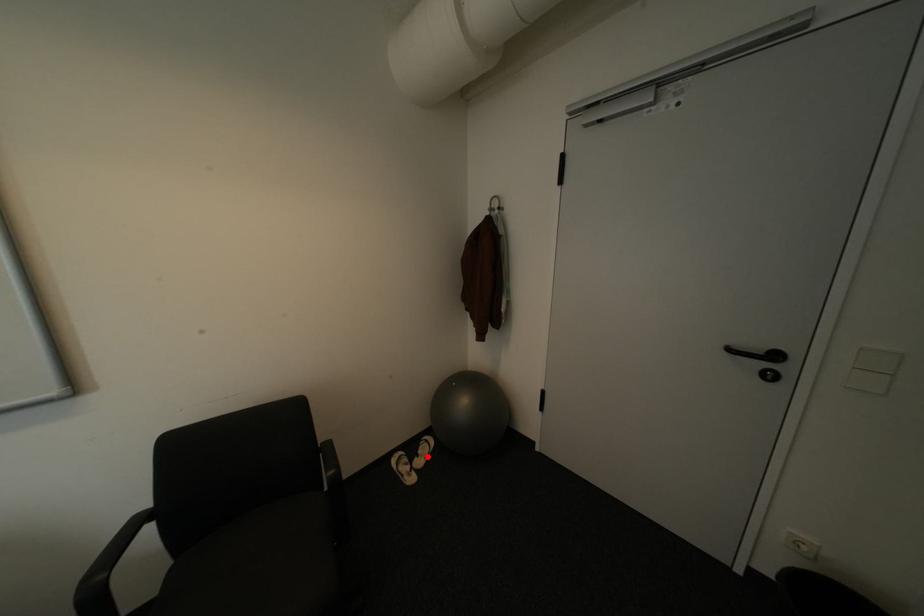
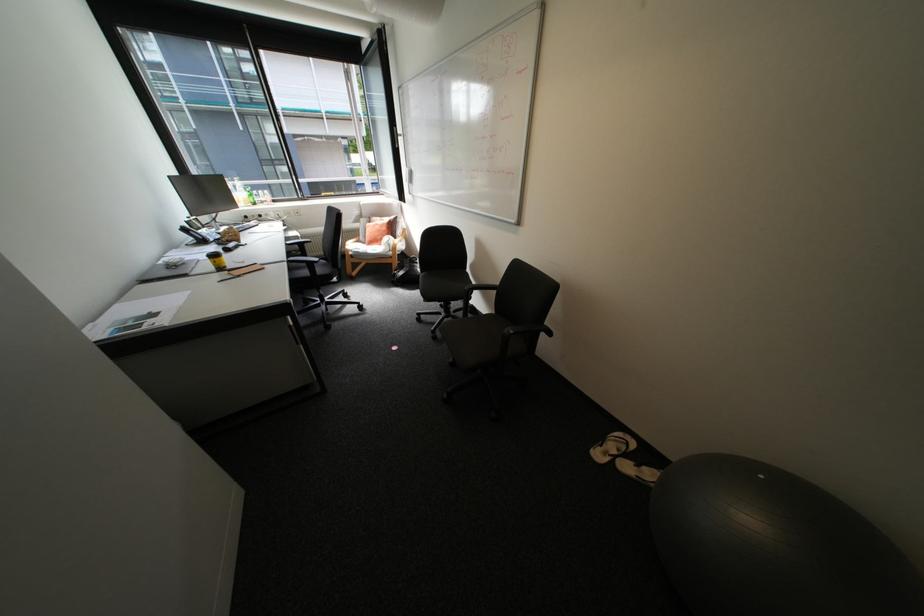
In the second image, find the point that corresponds to the highlighted location in the first image.

(645, 464)